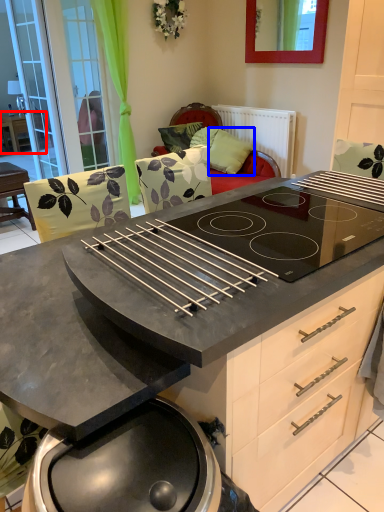
Question: Which of the following is the closest to the observer, table (highlighted by a red box) or pillow (highlighted by a blue box)?

Choices:
 (A) table
 (B) pillow

Answer: (B)